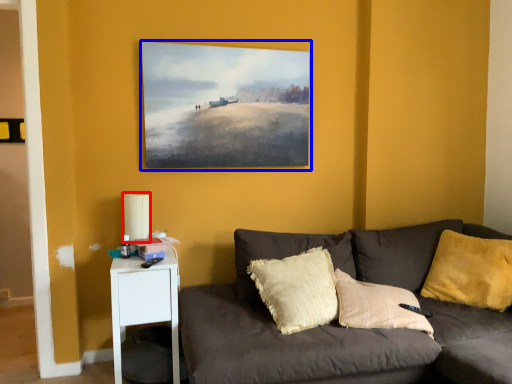
Question: Which object appears closest to the camera in this image, lamp (highlighted by a red box) or picture frame (highlighted by a blue box)?

Choices:
 (A) lamp
 (B) picture frame

Answer: (A)